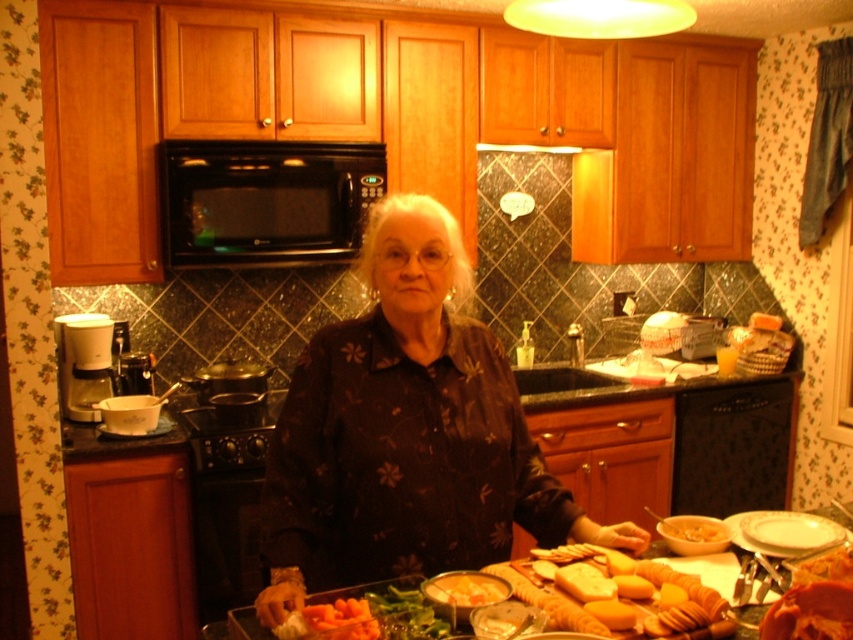
Image resolution: width=853 pixels, height=640 pixels. What do you see at coordinates (405, 433) in the screenshot?
I see `dark floral shirt at center` at bounding box center [405, 433].

Between point (347, 387) and point (369, 596), which one is positioned in front?

Positioned in front is point (369, 596).

In order to click on dark floral shirt at center in this screenshot , I will do [x=405, y=433].

Which is more to the right, yellowish matte bread at lower center or metallic silver exhaust hood at upper center?

metallic silver exhaust hood at upper center is more to the right.

Does point (479, 605) come closer to viewer compared to point (547, 147)?

Yes, point (479, 605) is closer to viewer.

Where is `yellowish matte bread at lower center`? yellowish matte bread at lower center is located at coordinates (466, 588).

Between white glossy plate at lower right and metallic silver exhaust hood at upper center, which one appears on the right side from the viewer's perspective?

Positioned to the right is white glossy plate at lower right.

Can you confirm if white glossy plate at lower right is thinner than metallic silver exhaust hood at upper center?

Correct, white glossy plate at lower right's width is less than metallic silver exhaust hood at upper center's.

Who is more forward, [735,532] or [538,147]?

Point [735,532] is more forward.

The height and width of the screenshot is (640, 853). In order to click on white glossy plate at lower right in this screenshot , I will do `click(782, 532)`.